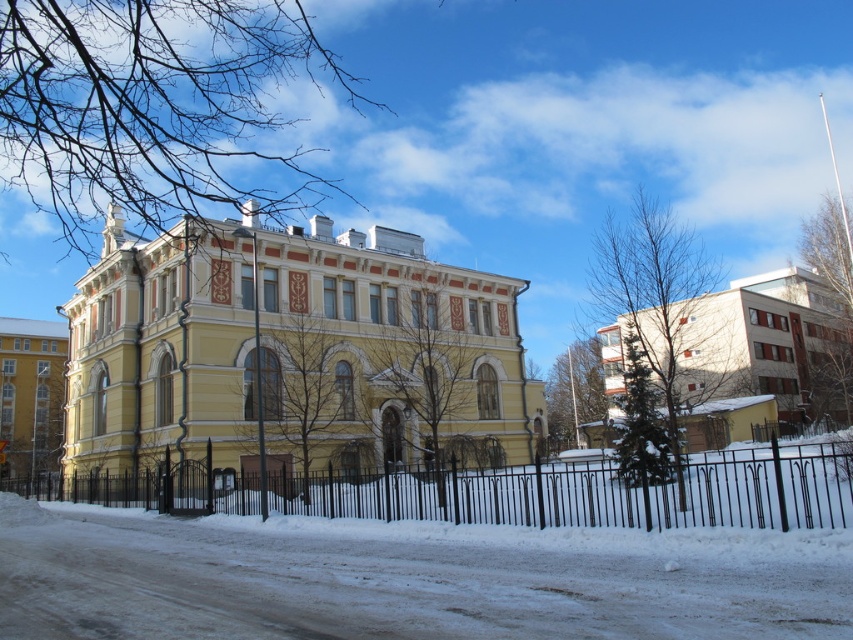
You are a photographer planning to take a wide shot of the yellow matte building at center and the yellow stone building at left. Based on their sizes in the image, which one would appear smaller in your photo?

The yellow matte building at center appears smaller in the photo because it occupies less space than the yellow stone building at left.

You are a tourist standing in front of the white matte building at right and the yellow stone building at left. Which building would appear larger to you?

The white matte building at right is much taller than the yellow stone building at left, so it would appear larger to you.

Based on the photo, you are a photographer planning to take a wide shot of both the white matte building at right and the yellow stone building at left. Based on their sizes, which building will appear bigger in the photo?

The white matte building at right will appear bigger in the photo because it is larger in size than the yellow stone building at left.